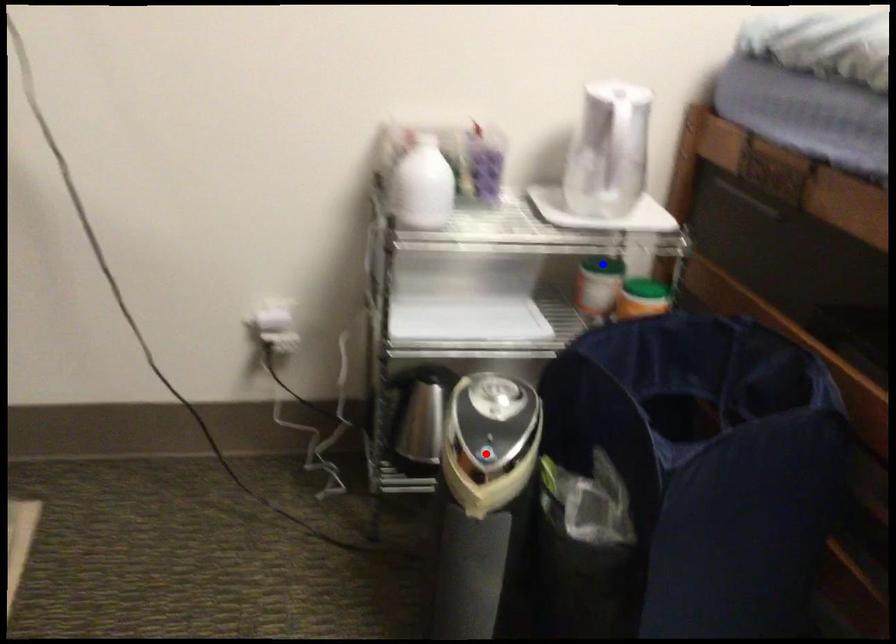
Question: Two points are marked on the image. Which point is closer to the camera?

Choices:
 (A) Blue point is closer.
 (B) Red point is closer.

Answer: (B)